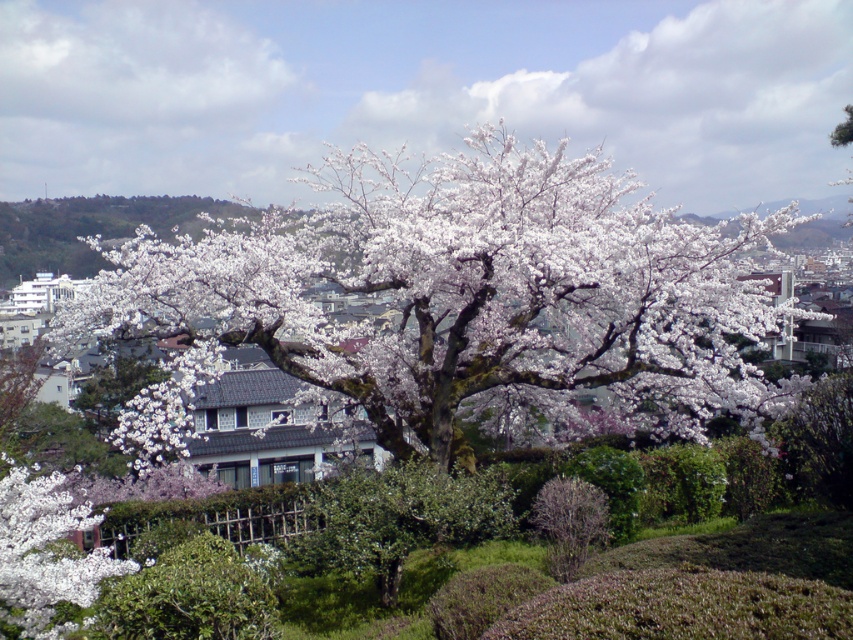
Question: Which of the following is the farthest from the observer?

Choices:
 (A) bare branches at center
 (B) green leafy bush at center
 (C) white matte tree at center

Answer: (C)

Question: Estimate the real-world distances between objects in this image. Which object is farther from the bare branches at center?

Choices:
 (A) white matte tree at center
 (B) green leafy bush at center

Answer: (A)

Question: Which of the following is the farthest from the observer?

Choices:
 (A) white matte tree at center
 (B) bare branches at center

Answer: (A)

Question: Does white matte tree at center appear over green leafy bush at center?

Choices:
 (A) yes
 (B) no

Answer: (A)

Question: Can you confirm if white matte tree at center is thinner than green leafy bush at center?

Choices:
 (A) yes
 (B) no

Answer: (B)

Question: Is green leafy bush at center above bare branches at center?

Choices:
 (A) no
 (B) yes

Answer: (A)